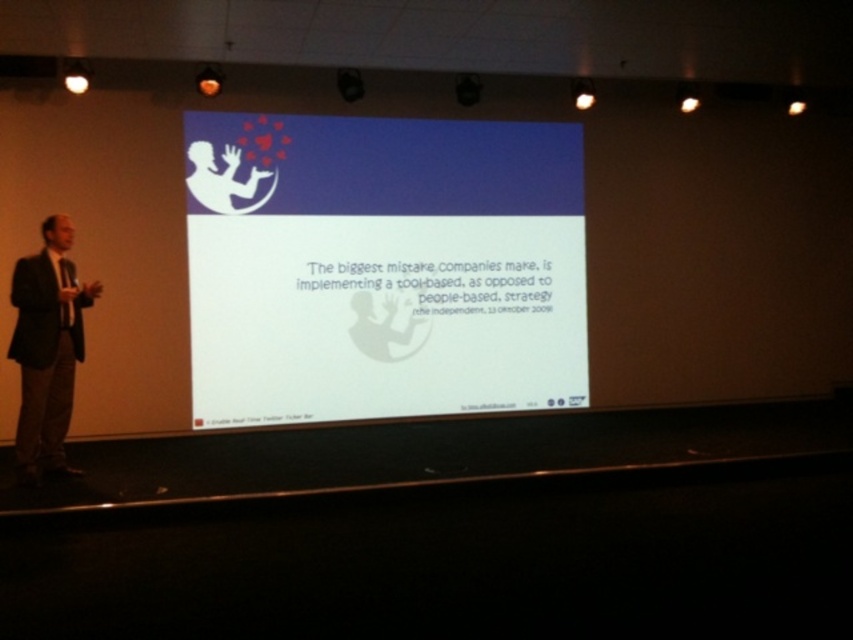
Does white matte projection screen at center have a larger size compared to dark suit at left?

Yes.

Is point (212, 188) in front of point (39, 412)?

No, it is behind (39, 412).

Which is in front, point (241, 198) or point (67, 250)?

Point (67, 250) is more forward.

Find the location of a particular element. The width and height of the screenshot is (853, 640). white matte projection screen at center is located at coordinates (381, 268).